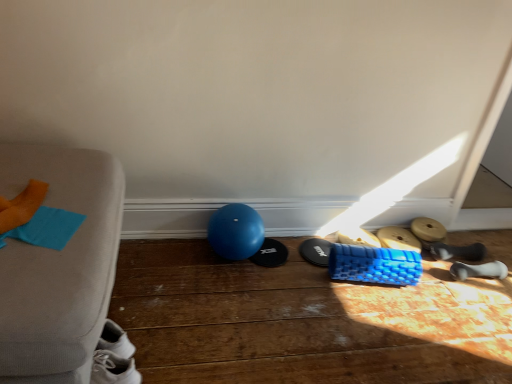
In order to click on vacant area that lies in front of blue textured foam roller at lower right, the 4th footwear when ordered from left to right in this screenshot , I will do `click(416, 284)`.